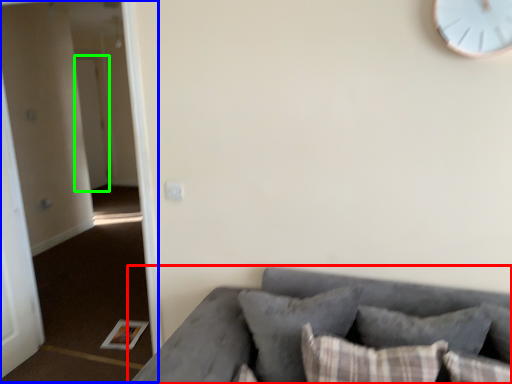
Question: Considering the real-world distances, which object is farthest from studio couch (highlighted by a red box)? corridor (highlighted by a blue box) or door (highlighted by a green box)?

Choices:
 (A) corridor
 (B) door

Answer: (B)